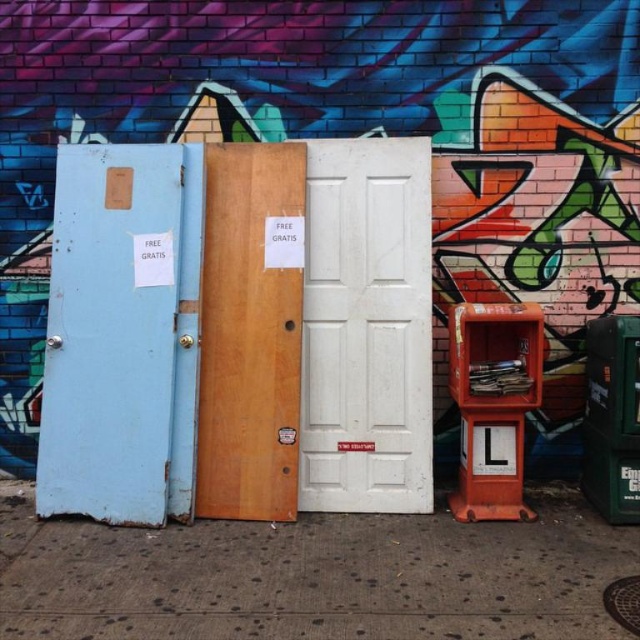
Measure the distance between point (x=28, y=634) and camera.

A distance of 3.10 meters exists between point (x=28, y=634) and camera.

Which is below, smooth concrete sidewalk at lower center or orange plastic phone box at lower right?

smooth concrete sidewalk at lower center is below.

Describe the element at coordinates (310, 577) in the screenshot. I see `smooth concrete sidewalk at lower center` at that location.

This screenshot has height=640, width=640. In order to click on smooth concrete sidewalk at lower center in this screenshot , I will do `click(310, 577)`.

Can you confirm if white painted wood door at center is wider than orange plastic phone box at lower right?

Indeed, white painted wood door at center has a greater width compared to orange plastic phone box at lower right.

Is white painted wood door at center bigger than orange plastic phone box at lower right?

No.

Is point (349, 509) positioned behind point (467, 451)?

That is True.

This screenshot has height=640, width=640. I want to click on white painted wood door at center, so coord(365,326).

Can you confirm if wooden door at center is positioned above orange plastic phone box at lower right?

Yes, wooden door at center is above orange plastic phone box at lower right.

At what (x,y) coordinates should I click in order to perform the action: click on wooden door at center. Please return your answer as a coordinate pair (x, y). This screenshot has height=640, width=640. Looking at the image, I should click on (250, 332).

Where is `wooden door at center`? This screenshot has width=640, height=640. wooden door at center is located at coordinates (250, 332).